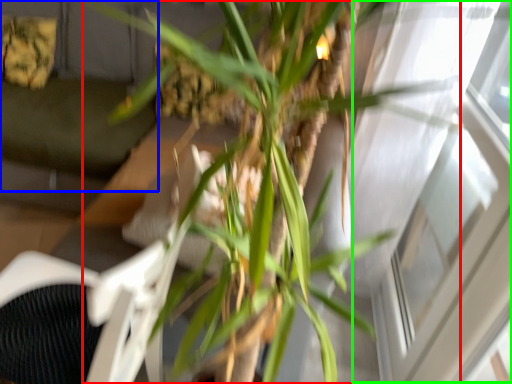
Question: Estimate the real-world distances between objects in this image. Which object is closer to houseplant (highlighted by a red box), couch (highlighted by a blue box) or window (highlighted by a green box)?

Choices:
 (A) couch
 (B) window

Answer: (B)